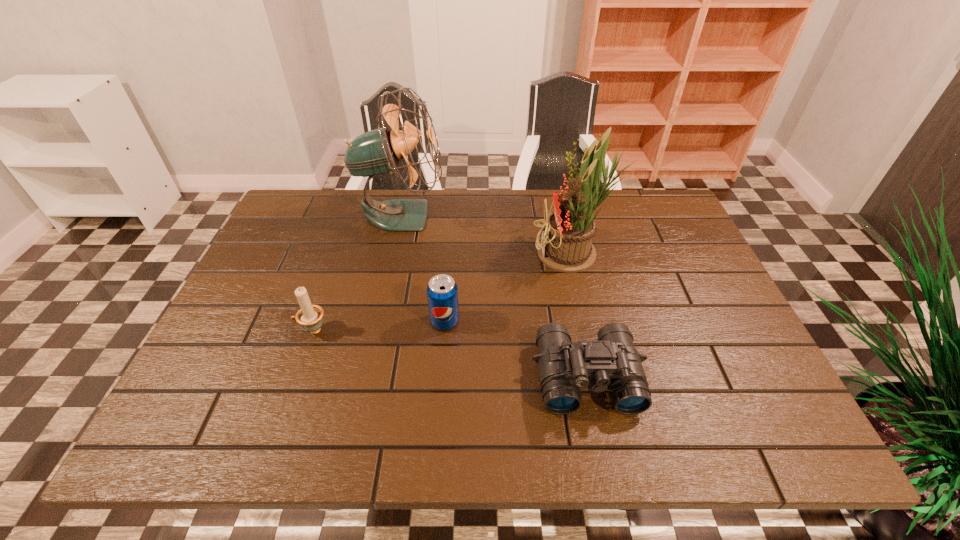
Find the location of a particular element. This screenshot has height=540, width=960. fan is located at coordinates (378, 151).

What are the coordinates of `flower arrangement` in the screenshot? It's located at (565, 246).

Locate an element on the screen. candle_holder is located at coordinates (309, 316).

I want to click on pop soda, so click(x=442, y=292).

Locate an element on the screen. The image size is (960, 540). the nearest object is located at coordinates (612, 362).

Identify the location of vacant space situated 0.050m on the front-facing side of the fan for air flow. (462, 215).

You are a GUI agent. You are given a task and a screenshot of the screen. Output one action in this format:
    pyautogui.click(x=<x>, y=<y>)
    Task: Click on the vacant space located in front of the flower arrangement with the fan visible
    
    Given the screenshot: What is the action you would take?
    pyautogui.click(x=408, y=254)

At what (x,y) coordinates should I click in order to perform the action: click on free space located in front of the flower arrangement with the fan visible. Please return your answer as a coordinate pair (x, y). Looking at the image, I should click on (444, 254).

This screenshot has width=960, height=540. In order to click on free space located in front of the flower arrangement with the fan visible in this screenshot , I will do `click(390, 254)`.

The width and height of the screenshot is (960, 540). Find the location of `vacant space located 0.150m on the handle side of the candle_holder`. vacant space located 0.150m on the handle side of the candle_holder is located at coordinates (230, 330).